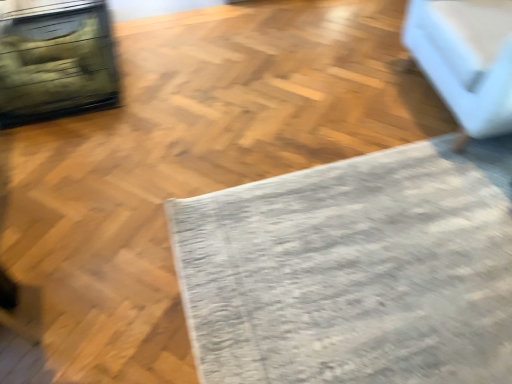
Locate an element on the screen. This screenshot has width=512, height=384. vacant point to the left of gray textured mat at center is located at coordinates (120, 211).